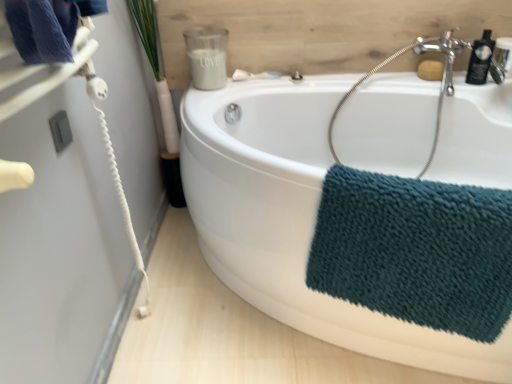
Identify the location of free space in front of green leafy plant at upper left. (177, 243).